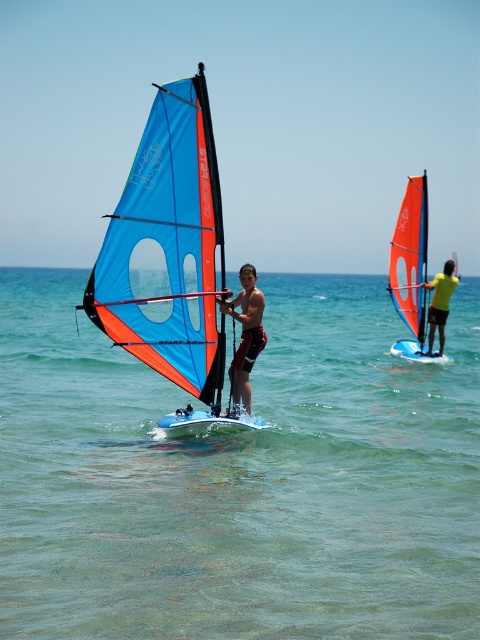
Can you confirm if clear blue water at center is thinner than blue matte sail at center?

Incorrect, clear blue water at center's width is not less than blue matte sail at center's.

Who is positioned more to the left, clear blue water at center or blue matte sail at center?

blue matte sail at center is more to the left.

Is point (12, 403) closer to viewer compared to point (247, 424)?

No, (12, 403) is behind (247, 424).

Image resolution: width=480 pixels, height=640 pixels. In order to click on clear blue water at center in this screenshot , I will do `click(240, 477)`.

Which is more to the right, blue matte sail at center or orange sail at right?

Positioned to the right is orange sail at right.

You are a GUI agent. You are given a task and a screenshot of the screen. Output one action in this format:
    pyautogui.click(x=<x>, y=<y>)
    Task: Click on the blue matte sail at center
    
    Given the screenshot: What is the action you would take?
    pyautogui.click(x=168, y=253)

The width and height of the screenshot is (480, 640). I want to click on blue matte sail at center, so click(x=168, y=253).

The image size is (480, 640). Identify the location of blue matte sail at center. (168, 253).

Does clear blue water at center have a greater height compared to orange sail at right?

Correct, clear blue water at center is much taller as orange sail at right.

Is the position of clear blue water at center more distant than that of orange sail at right?

That is False.

Is point (397, 376) positioned before point (440, 346)?

Yes.

This screenshot has width=480, height=640. In order to click on clear blue water at center in this screenshot , I will do `click(240, 477)`.